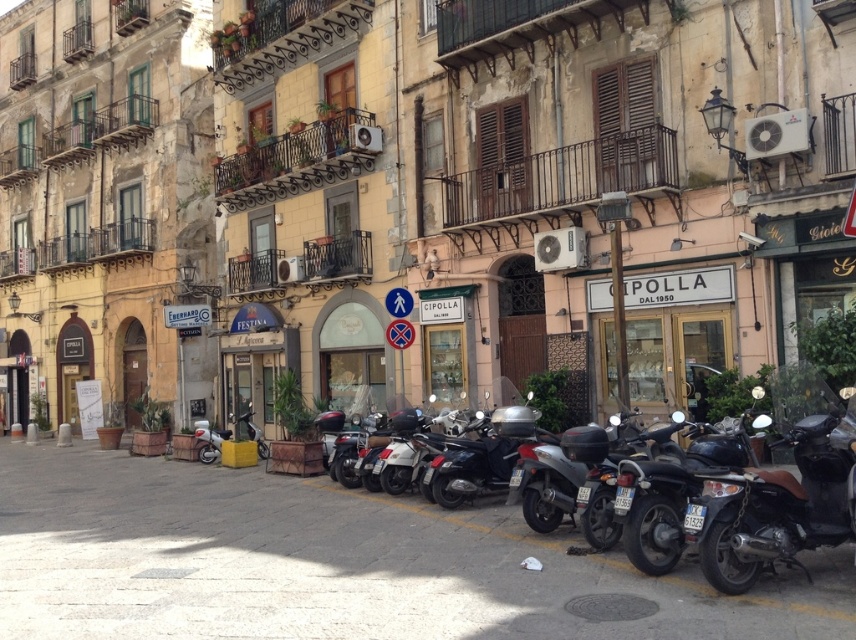
You are a delivery person who needs to park your 1.8 meters tall delivery box next to the shiny black motorcycle at center right and the white glossy scooter at center. Can you place it between them without tilting the box?

The shiny black motorcycle at center right is taller than the white glossy scooter at center, so the delivery box can be placed between them as long as it is positioned under the motorcycle and above the scooter to avoid tilting.

You are standing at the point with coordinates (x=774, y=504) in the historic European town. What object is located exactly at this point?

The shiny black scooter at lower right is located exactly at point (x=774, y=504).